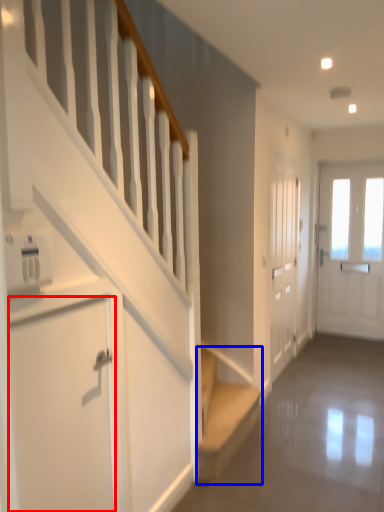
Question: Which point is closer to the camera, door (highlighted by a red box) or stairs (highlighted by a blue box)?

Choices:
 (A) door
 (B) stairs

Answer: (A)